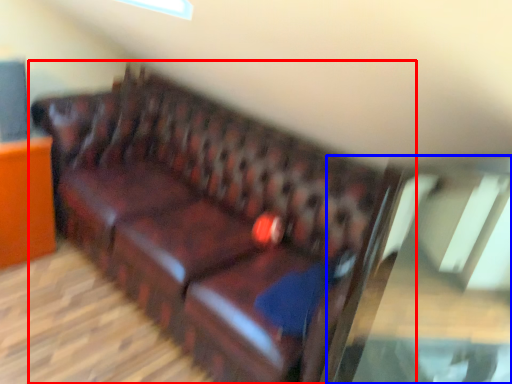
Question: Among these objects, which one is farthest to the camera, studio couch (highlighted by a red box) or glass table (highlighted by a blue box)?

Choices:
 (A) studio couch
 (B) glass table

Answer: (A)